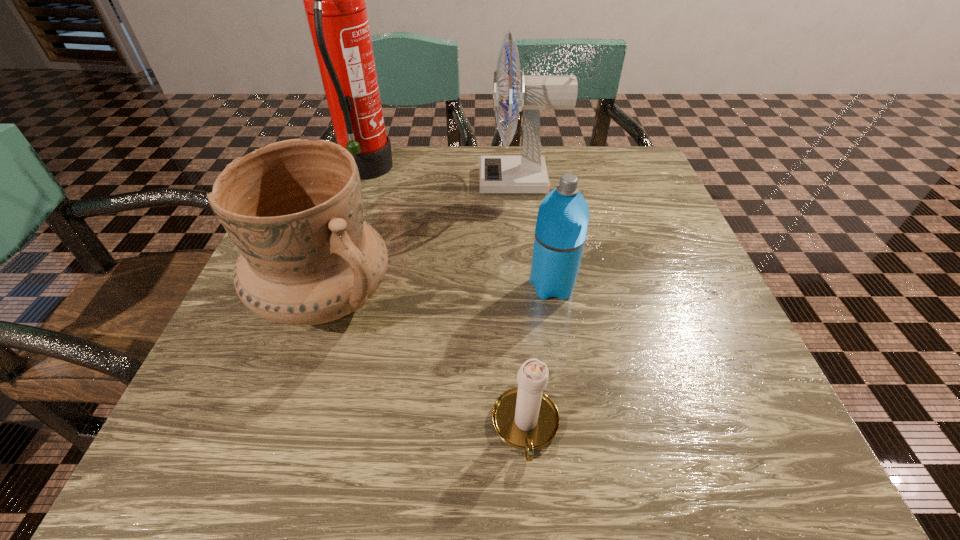
Identify the location of vacant area that lies between the thermos bottle and the pottery. (439, 292).

Locate an element on the screen. This screenshot has width=960, height=540. free space that is in between the pottery and the second tallest object is located at coordinates (422, 239).

Find the location of a particular element. This screenshot has height=540, width=960. empty location between the shortest object and the thermos bottle is located at coordinates 539,356.

Select which object appears as the third closest to the pottery. Please provide its 2D coordinates. Your answer should be formatted as a tuple, i.e. [(x, y)], where the tuple contains the x and y coordinates of a point satisfying the conditions above.

[(526, 174)]

Find the location of a particular element. object that is the second closest one to the thermos bottle is located at coordinates (526, 174).

Locate an element on the screen. The height and width of the screenshot is (540, 960). vacant region that satisfies the following two spatial constraints: 1. on the front-facing side of the second tallest object; 2. on the right side of the thermos bottle is located at coordinates pyautogui.click(x=533, y=286).

The image size is (960, 540). Identify the location of blank area in the image that satisfies the following two spatial constraints: 1. on the front-facing side of the thermos bottle; 2. on the right side of the fourth shortest object. (533, 286).

This screenshot has height=540, width=960. I want to click on vacant space that satisfies the following two spatial constraints: 1. on the front-facing side of the tallest object; 2. on the back side of the thermos bottle, so pos(326,286).

The height and width of the screenshot is (540, 960). Identify the location of vacant space that satisfies the following two spatial constraints: 1. on the front-facing side of the fan; 2. on the right side of the thermos bottle. (533, 286).

The width and height of the screenshot is (960, 540). In order to click on free region that satisfies the following two spatial constraints: 1. on the front-facing side of the second tallest object; 2. on the handle side of the nearest object in this screenshot , I will do `click(549, 427)`.